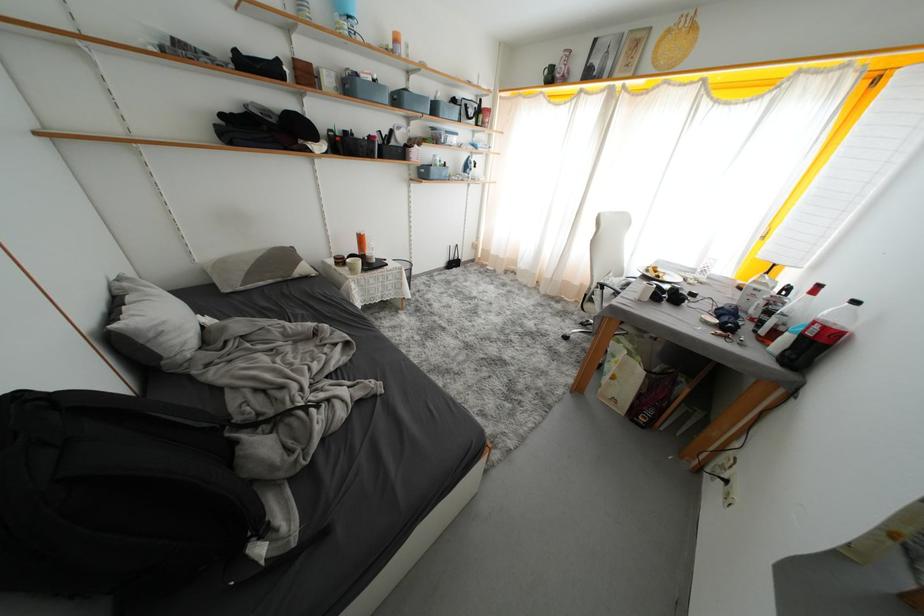
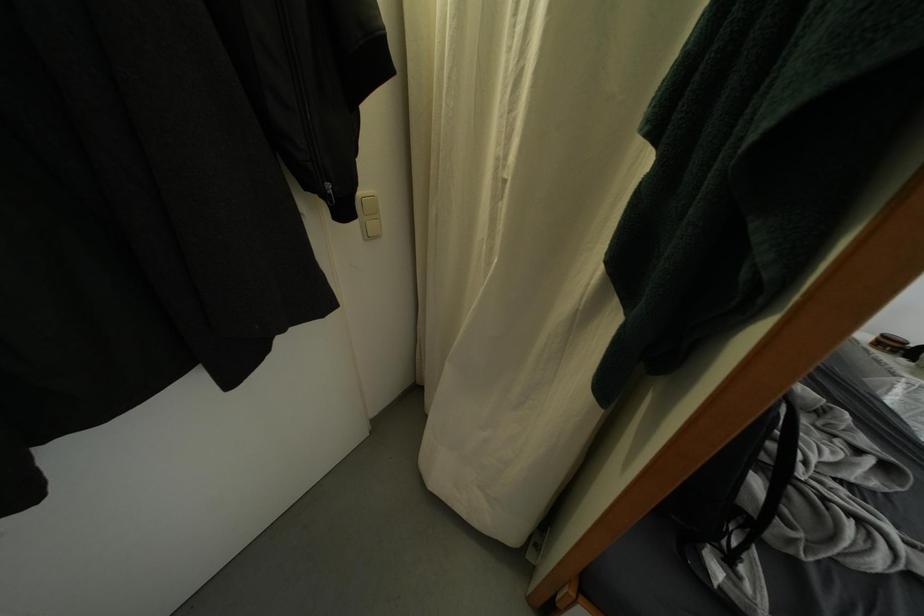
The point at (x=343, y=268) is marked in the first image. Where is the corresponding point in the second image?

(884, 347)